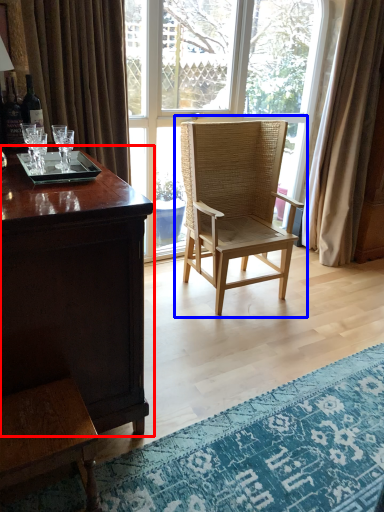
Question: Which object is further to the camera taking this photo, desk (highlighted by a red box) or chair (highlighted by a blue box)?

Choices:
 (A) desk
 (B) chair

Answer: (B)